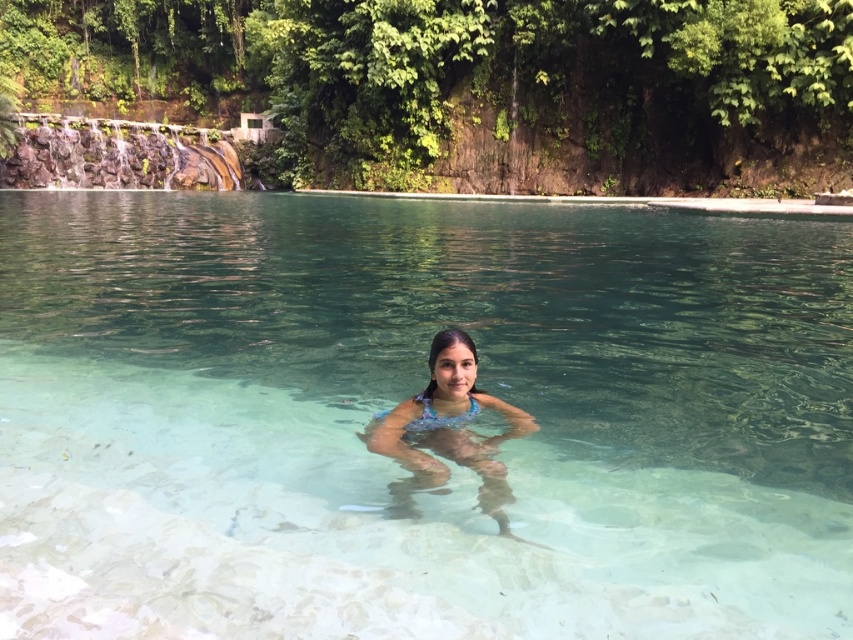
Question: Which point is farther to the camera?

Choices:
 (A) (412, 468)
 (B) (438, 264)

Answer: (B)

Question: Is clear glass pool at center closer to the viewer compared to translucent blue bikini at center?

Choices:
 (A) yes
 (B) no

Answer: (A)

Question: Can you confirm if clear glass pool at center is positioned to the left of translucent blue bikini at center?

Choices:
 (A) yes
 (B) no

Answer: (A)

Question: Which point appears closest to the camera in this image?

Choices:
 (A) (289, 248)
 (B) (445, 454)

Answer: (B)

Question: Can you confirm if clear glass pool at center is positioned to the left of translucent blue bikini at center?

Choices:
 (A) yes
 (B) no

Answer: (A)